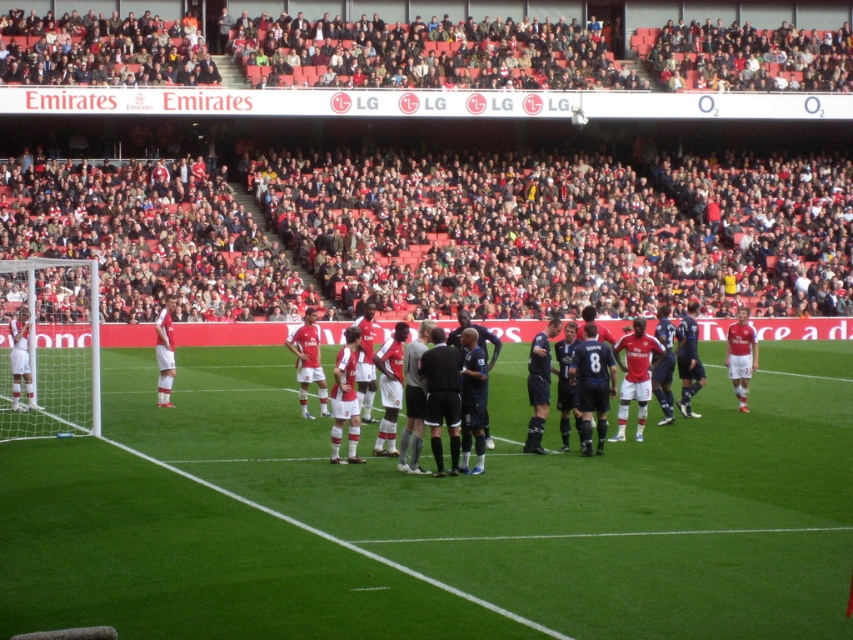
Question: Can you confirm if green artificial turf at center is thinner than black smooth referee at center?

Choices:
 (A) no
 (B) yes

Answer: (A)

Question: Which object is the farthest from the black smooth shirt at center?

Choices:
 (A) dark blue jersey at center
 (B) white jersey at left

Answer: (B)

Question: Which of these objects is positioned farthest from the black smooth referee at center?

Choices:
 (A) black smooth shirt at center
 (B) green artificial turf at center
 (C) dark blue jersey at center

Answer: (B)

Question: Is green artificial turf at center below dark blue jersey at center?

Choices:
 (A) yes
 (B) no

Answer: (A)

Question: Is green artificial turf at center further to camera compared to dark blue jersey at center?

Choices:
 (A) no
 (B) yes

Answer: (A)

Question: Which point is farther from the camera taking this photo?

Choices:
 (A) (428, 348)
 (B) (166, 330)

Answer: (B)